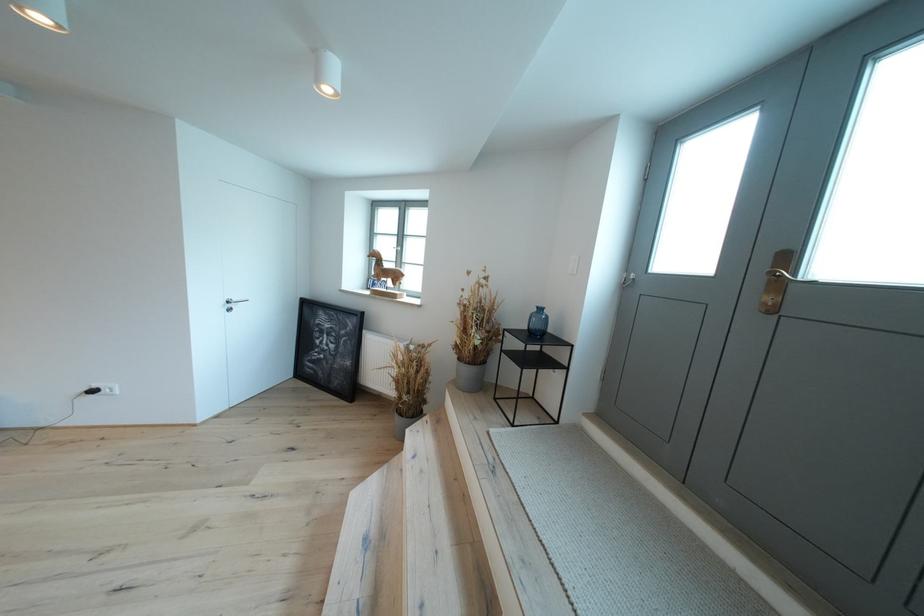
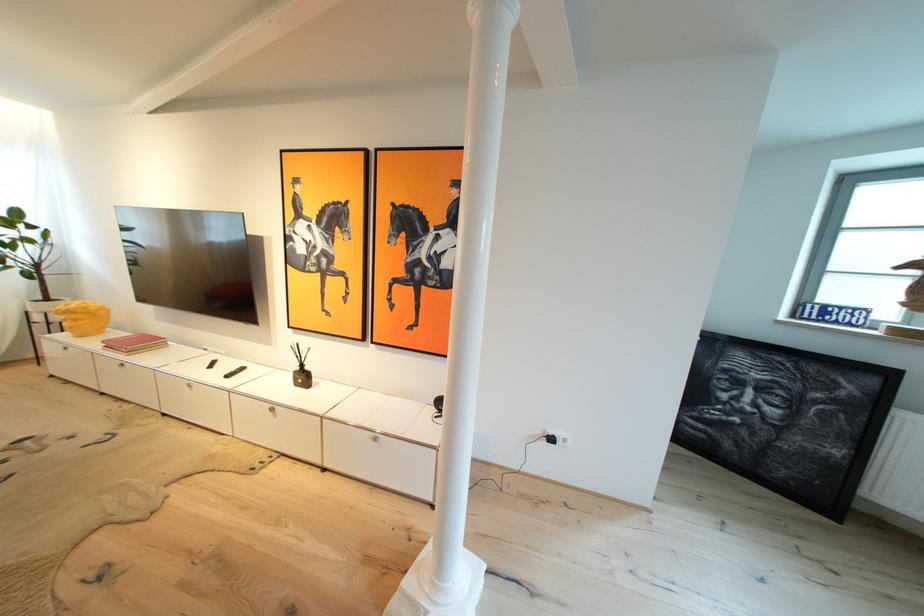
Question: In a continuous first-person perspective shot, in which direction is the camera moving?

Choices:
 (A) Left
 (B) Right
 (C) Forward
 (D) Backward

Answer: (A)